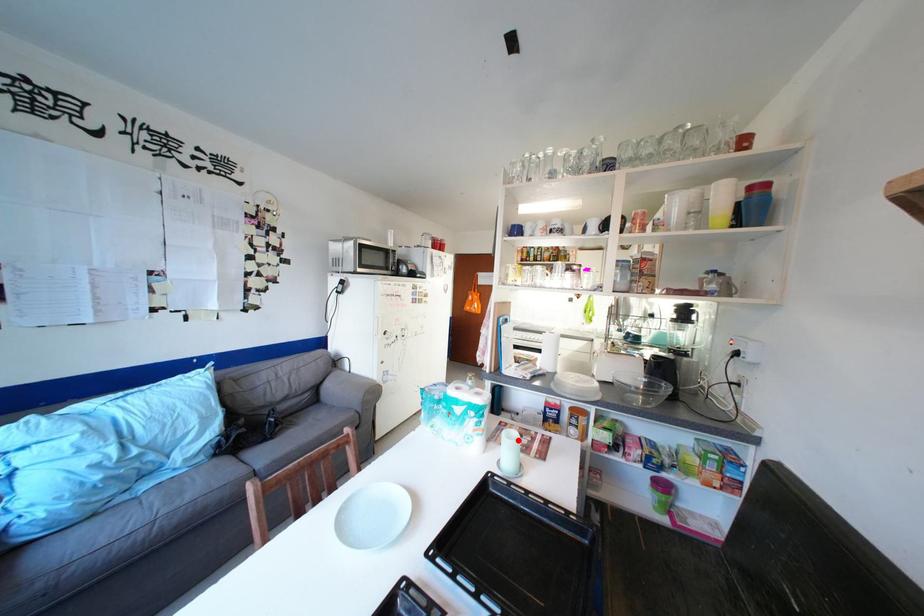
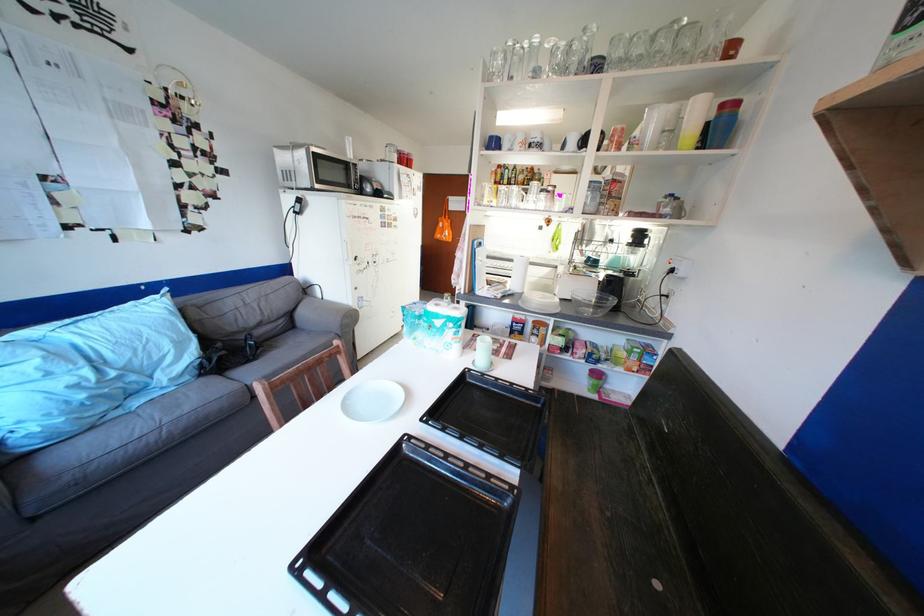
Question: I am providing you with two images of the same scene from different viewpoints. In image1, a red point is highlighted. Considering the same 3D point in image2, which of the following is correct?

Choices:
 (A) It is closer
 (B) It is farther

Answer: (B)